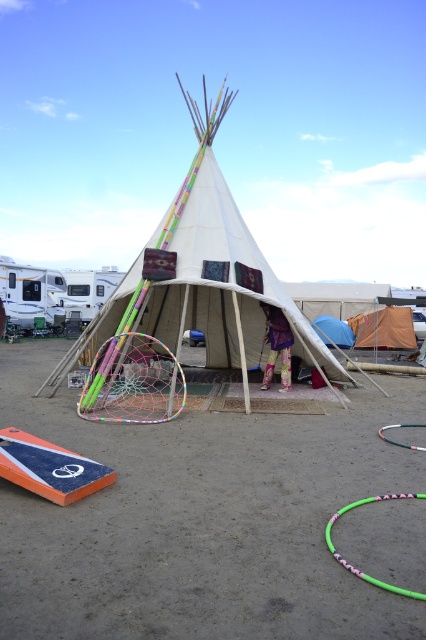
Question: Does multicolored netting hula hoop at center come behind orange canvas tent at center?

Choices:
 (A) yes
 (B) no

Answer: (B)

Question: Which object is positioned closest to the orange canvas tent at center?

Choices:
 (A) dirt field at center
 (B) multicolored netting hula hoop at center
 (C) blue fabric tent at center

Answer: (C)

Question: Does dirt field at center have a smaller size compared to white canvas teepee at center?

Choices:
 (A) yes
 (B) no

Answer: (A)

Question: Is white canvas teepee at center wider than blue fabric tent at center?

Choices:
 (A) yes
 (B) no

Answer: (A)

Question: Which point is farther from the camera taking this photo?

Choices:
 (A) (175, 371)
 (B) (161, 278)
 (C) (408, 340)

Answer: (C)

Question: Based on their relative distances, which object is farther from the multicolored netting hula hoop at center?

Choices:
 (A) dirt field at center
 (B) white canvas teepee at center
 (C) blue fabric tent at center

Answer: (C)